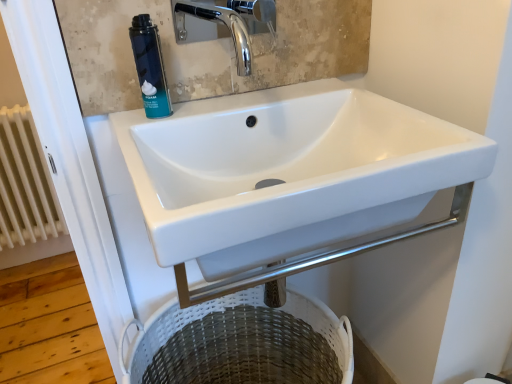
What do you see at coordinates (356, 97) in the screenshot? I see `white glossy sink at center` at bounding box center [356, 97].

Find the location of a particular element. This screenshot has height=384, width=512. white woven laundry basket at lower center is located at coordinates (244, 343).

Find the location of a particular element. The width and height of the screenshot is (512, 384). chrome metallic faucet at upper center is located at coordinates (230, 23).

Where is `radiator lying on the left of white glossy sink at center`? radiator lying on the left of white glossy sink at center is located at coordinates (25, 183).

How distant is white painted metal radiator at left from white glossy sink at center?

The distance of white painted metal radiator at left from white glossy sink at center is 3.38 feet.

From the image's perspective, relative to white glossy sink at center, is white painted metal radiator at left above or below?

white painted metal radiator at left is above white glossy sink at center.

Can you confirm if white painted metal radiator at left is shorter than white glossy sink at center?

In fact, white painted metal radiator at left may be taller than white glossy sink at center.

Based on the photo, is white glossy sink at center at the back of blue matte foam canister at upper left?

No, blue matte foam canister at upper left is not facing away from white glossy sink at center.

From a real-world perspective, which is physically above, blue matte foam canister at upper left or white glossy sink at center?

In real-world perspective, blue matte foam canister at upper left is above.

Which is in front, point (153, 32) or point (227, 154)?

Point (153, 32)

Is blue matte foam canister at upper left facing towards white woven laundry basket at lower center?

No.

Can you confirm if blue matte foam canister at upper left is thinner than white woven laundry basket at lower center?

Indeed, blue matte foam canister at upper left has a lesser width compared to white woven laundry basket at lower center.

From a real-world perspective, is blue matte foam canister at upper left beneath white woven laundry basket at lower center?

Answer: Incorrect, from a real-world perspective, blue matte foam canister at upper left is higher than white woven laundry basket at lower center.

Which of these two, white woven laundry basket at lower center or blue matte foam canister at upper left, stands taller?

white woven laundry basket at lower center is taller.

Considering the relative positions of white woven laundry basket at lower center and blue matte foam canister at upper left in the image provided, is white woven laundry basket at lower center to the left or to the right of blue matte foam canister at upper left?

white woven laundry basket at lower center is to the right of blue matte foam canister at upper left.

Where is `laundry basket lying in front of the blue matte foam canister at upper left`? This screenshot has height=384, width=512. laundry basket lying in front of the blue matte foam canister at upper left is located at coordinates (244, 343).

Consider the image. Looking at the image, does white woven laundry basket at lower center seem bigger or smaller compared to blue matte foam canister at upper left?

Clearly, white woven laundry basket at lower center is larger in size than blue matte foam canister at upper left.

Measure the distance between white woven laundry basket at lower center and white glossy sink at center.

white woven laundry basket at lower center is 13.64 inches away from white glossy sink at center.

Could you tell me if white woven laundry basket at lower center is facing white glossy sink at center?

No, white woven laundry basket at lower center is not facing towards white glossy sink at center.

Considering the relative sizes of white woven laundry basket at lower center and white glossy sink at center in the image provided, is white woven laundry basket at lower center thinner than white glossy sink at center?

Yes, white woven laundry basket at lower center is thinner than white glossy sink at center.

From a real-world perspective, which object rests below the other?

white woven laundry basket at lower center.

Is white woven laundry basket at lower center at the back of chrome metallic faucet at upper center?

No, chrome metallic faucet at upper center is not facing away from white woven laundry basket at lower center.

Between chrome metallic faucet at upper center and white woven laundry basket at lower center, which one has more height?

With more height is white woven laundry basket at lower center.

Can we say chrome metallic faucet at upper center lies outside white woven laundry basket at lower center?

Yes, chrome metallic faucet at upper center is outside of white woven laundry basket at lower center.

From a real-world perspective, which object rests below the other?

white woven laundry basket at lower center, from a real-world perspective.

Measure the distance from chrome metallic faucet at upper center to white painted metal radiator at left.

The distance of chrome metallic faucet at upper center from white painted metal radiator at left is 37.26 inches.

From the image's perspective, which is below, chrome metallic faucet at upper center or white painted metal radiator at left?

From the image's view, white painted metal radiator at left is below.

Is chrome metallic faucet at upper center facing away from white painted metal radiator at left?

No.

Can you confirm if chrome metallic faucet at upper center is thinner than white painted metal radiator at left?

No, chrome metallic faucet at upper center is not thinner than white painted metal radiator at left.

Find the location of a particular element. The width and height of the screenshot is (512, 384). radiator lying above the white glossy sink at center (from the image's perspective) is located at coordinates (25, 183).

At what (x,y) coordinates should I click in order to perform the action: click on mouthwash behind the white glossy sink at center. Please return your answer as a coordinate pair (x, y). The width and height of the screenshot is (512, 384). Looking at the image, I should click on (150, 67).

Considering their positions, is blue matte foam canister at upper left positioned closer to chrome metallic faucet at upper center than white painted metal radiator at left?

blue matte foam canister at upper left.

From the picture: When comparing their distances from white painted metal radiator at left, does white glossy sink at center or blue matte foam canister at upper left seem further?

blue matte foam canister at upper left.

Looking at this image, considering their positions, is white painted metal radiator at left positioned further to chrome metallic faucet at upper center than white glossy sink at center?

white painted metal radiator at left.

Which object lies further to the anchor point white glossy sink at center, chrome metallic faucet at upper center or blue matte foam canister at upper left?

The object further to white glossy sink at center is chrome metallic faucet at upper center.

From the image, which object appears to be farther from white woven laundry basket at lower center, white glossy sink at center or chrome metallic faucet at upper center?

chrome metallic faucet at upper center is positioned further to the anchor white woven laundry basket at lower center.

Considering their positions, is chrome metallic faucet at upper center positioned further to white woven laundry basket at lower center than white painted metal radiator at left?

chrome metallic faucet at upper center.

Which object lies further to the anchor point blue matte foam canister at upper left, white woven laundry basket at lower center or chrome metallic faucet at upper center?

chrome metallic faucet at upper center is further to blue matte foam canister at upper left.

From the image, which object appears to be nearer to white glossy sink at center, blue matte foam canister at upper left or chrome metallic faucet at upper center?

Based on the image, blue matte foam canister at upper left appears to be nearer to white glossy sink at center.

Locate an element on the screen. This screenshot has height=384, width=512. mouthwash between white glossy sink at center and white painted metal radiator at left from front to back is located at coordinates (150, 67).

The width and height of the screenshot is (512, 384). I want to click on sink between chrome metallic faucet at upper center and white woven laundry basket at lower center from top to bottom, so click(356, 97).

Identify the location of laundry basket between white painted metal radiator at left and chrome metallic faucet at upper center in the horizontal direction. The height and width of the screenshot is (384, 512). (244, 343).

You are a GUI agent. You are given a task and a screenshot of the screen. Output one action in this format:
    pyautogui.click(x=<x>, y=<y>)
    Task: Click on the sink between blue matte foam canister at upper left and white woven laundry basket at lower center vertically
    Image resolution: width=512 pixels, height=384 pixels.
    Given the screenshot: What is the action you would take?
    pyautogui.click(x=356, y=97)